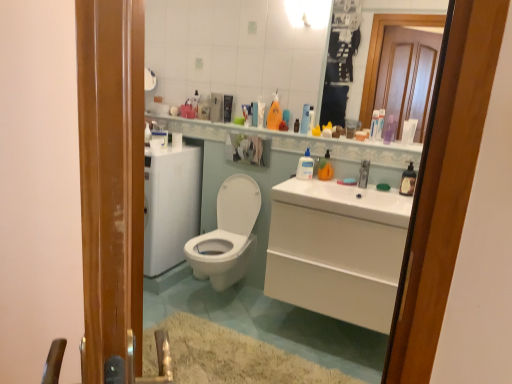
This screenshot has width=512, height=384. Identify the location of vacant space to the right of translucent plastic tube at upper center, which appears as the 7th toiletry when viewed from the left. (394, 144).